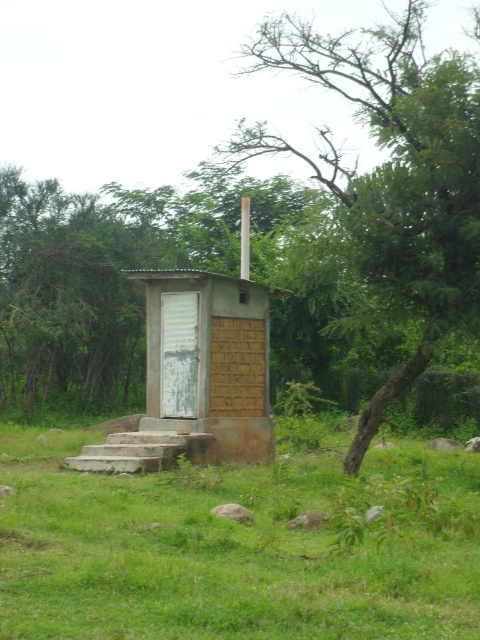
Question: Which of these objects is positioned farthest from the brown corrugated metal hut at center?

Choices:
 (A) brown concrete outhouse at center
 (B) green leafy tree at center

Answer: (B)

Question: Is brown concrete outhouse at center positioned before green leafy tree at center?

Choices:
 (A) yes
 (B) no

Answer: (A)

Question: Does brown concrete outhouse at center come behind green leafy tree at center?

Choices:
 (A) no
 (B) yes

Answer: (A)

Question: Which object appears closest to the camera in this image?

Choices:
 (A) brown concrete outhouse at center
 (B) brown corrugated metal hut at center

Answer: (A)

Question: In this image, where is brown concrete outhouse at center located relative to brown corrugated metal hut at center?

Choices:
 (A) above
 (B) below

Answer: (B)

Question: Which of the following is the farthest from the observer?

Choices:
 (A) brown corrugated metal hut at center
 (B) green leafy tree at center
 (C) brown concrete outhouse at center

Answer: (A)